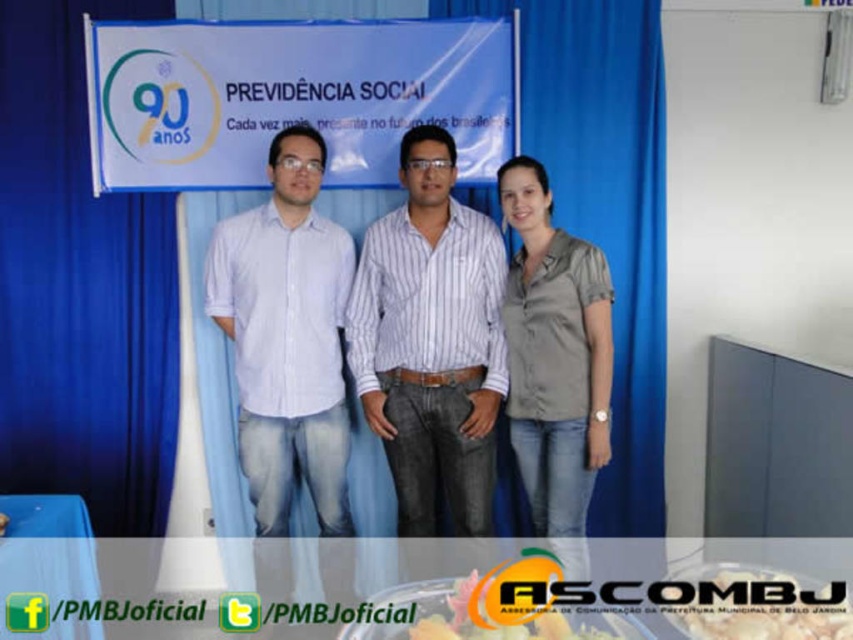
Is blue fabric curtain at left bigger than striped cotton shirt at center?

No.

Is point (142, 241) positioned in front of point (473, 308)?

That is False.

Who is more forward, (x=74, y=298) or (x=427, y=243)?

Point (x=427, y=243) is in front.

This screenshot has height=640, width=853. Identify the location of blue fabric curtain at left. (80, 288).

Does blue fabric curtain at center appear on the right side of yellow matte cake at center?

Indeed, blue fabric curtain at center is positioned on the right side of yellow matte cake at center.

Does blue fabric curtain at center have a greater height compared to yellow matte cake at center?

Yes, blue fabric curtain at center is taller than yellow matte cake at center.

Between point (608, 241) and point (459, 582), which one is positioned behind?

Point (608, 241)

You are a GUI agent. You are given a task and a screenshot of the screen. Output one action in this format:
    pyautogui.click(x=<x>, y=<y>)
    Task: Click on the blue fabric curtain at center
    This screenshot has width=853, height=640.
    Given the screenshot: What is the action you would take?
    pyautogui.click(x=605, y=205)

Looking at this image, is light blue striped shirt at center further to the viewer compared to blue plastic table at lower left?

Yes, it is behind blue plastic table at lower left.

Between point (273, 275) and point (62, 600), which one is positioned behind?

The point (273, 275) is behind.

Identify the location of light blue striped shirt at center. (287, 337).